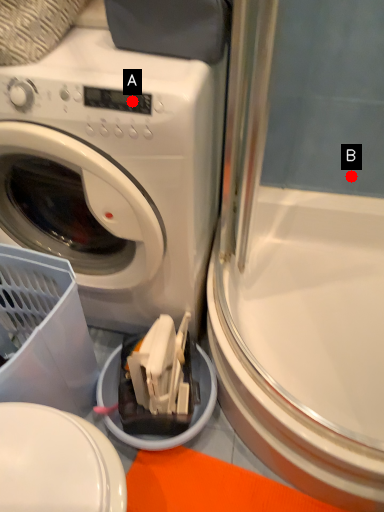
Question: Two points are circled on the image, labeled by A and B beside each circle. Which point is closer to the camera taking this photo?

Choices:
 (A) A is closer
 (B) B is closer

Answer: (A)